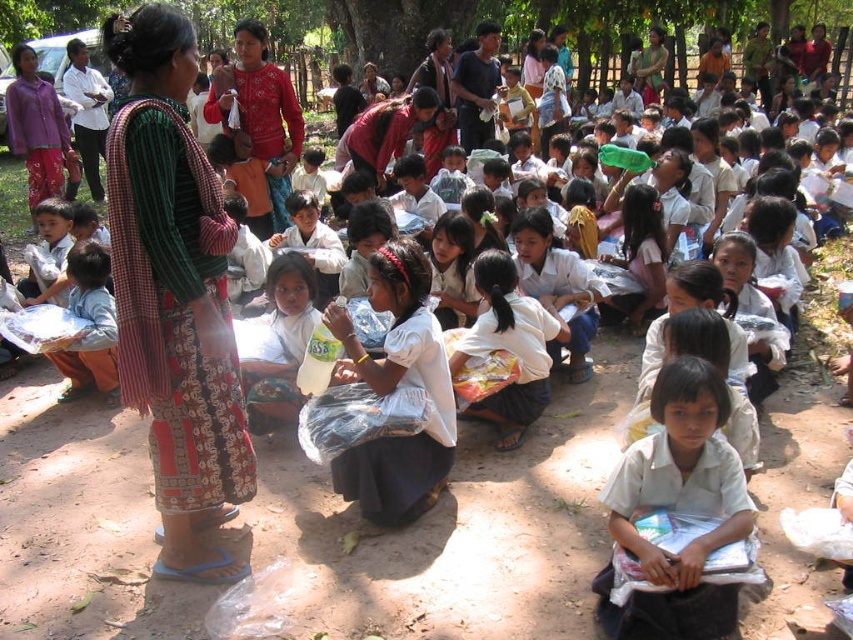
Question: Based on their relative distances, which object is nearer to the green leafy tree at upper center?

Choices:
 (A) printed cotton dress at left
 (B) red woven fabric at center

Answer: (B)

Question: Which of the following is the closest to the observer?

Choices:
 (A) (216, 326)
 (B) (666, 442)
 (C) (375, 33)

Answer: (B)

Question: Does printed cotton dress at left have a lesser width compared to red woven fabric at center?

Choices:
 (A) no
 (B) yes

Answer: (B)

Question: Which point is closer to the camera taking this photo?

Choices:
 (A) (755, 12)
 (B) (625, 472)
 (C) (256, 212)

Answer: (B)

Question: Can you confirm if printed cotton dress at left is positioned to the right of red woven fabric at center?

Choices:
 (A) yes
 (B) no

Answer: (A)

Question: Is printed cotton dress at left wider than red woven fabric at center?

Choices:
 (A) no
 (B) yes

Answer: (A)